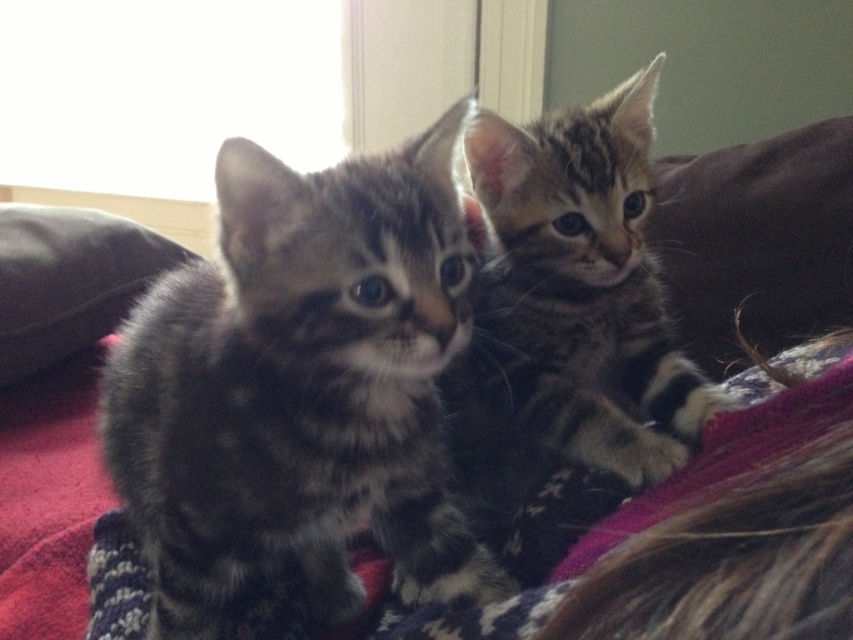
You are a cat owner who wants to ensure your gray tabby kitten at center stays warm during the night. The knitted wool blanket at center is known to retain heat effectively. Given their proximity, can the blanket sufficiently cover the kitten without moving either?

The gray tabby kitten at center is only 4.58 inches away from the knitted wool blanket at center. Since the blanket is designed to retain heat and is close enough, it can likely cover the kitten sufficiently without needing to move either.

You are a photographer trying to capture both the tabby fur kitten at center and the knitted wool blanket at center in a single frame. Given that the kitten is smaller, how might you adjust your camera angle to ensure both are clearly visible?

Since the tabby fur kitten at center is smaller than the knitted wool blanket at center, you can lower your camera angle to capture more of the blanket while still framing the kitten centrally, ensuring both are in focus and visible.